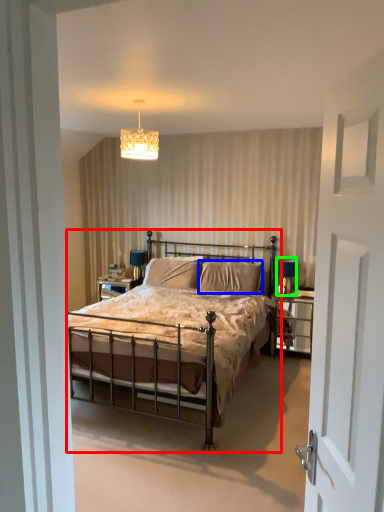
Question: Considering the real-world distances, which object is closest to bed (highlighted by a red box)? pillow (highlighted by a blue box) or table lamp (highlighted by a green box).

Choices:
 (A) pillow
 (B) table lamp

Answer: (A)